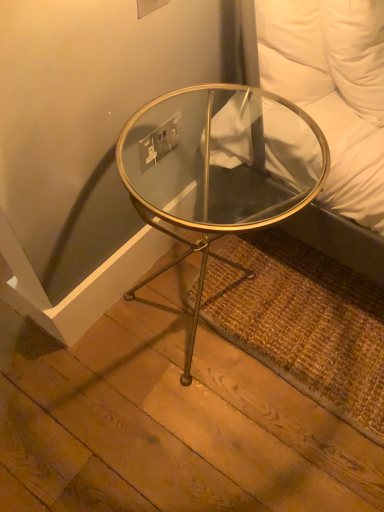
At what (x,y) coordinates should I click in order to perform the action: click on vacant space in front of clear glass table at center. Please return your answer as a coordinate pair (x, y). This screenshot has height=512, width=384. Looking at the image, I should click on (195, 432).